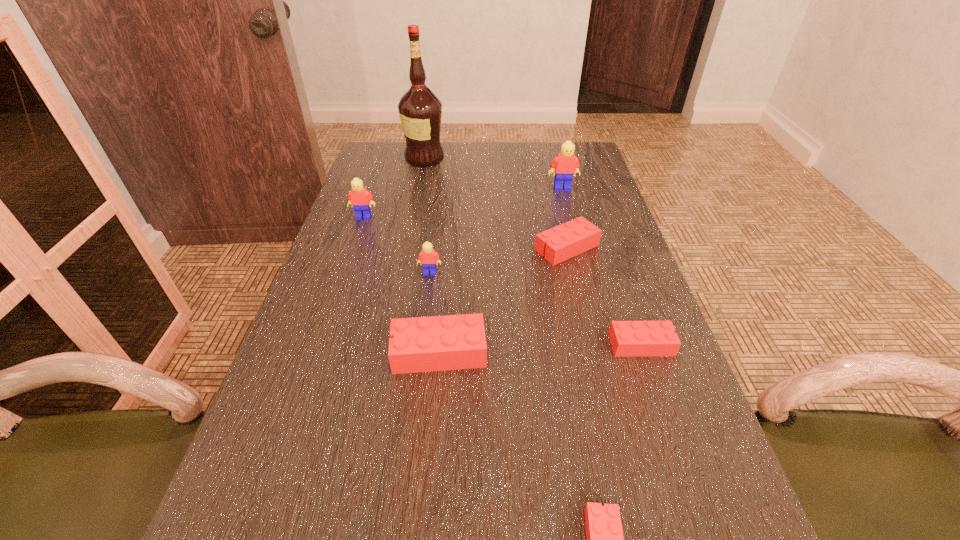
In order to click on yellow Lego that is the second closest to the nearest yellow Lego in this screenshot , I will do `click(565, 164)`.

Find the location of a particular element. The height and width of the screenshot is (540, 960). the third closest red Lego to the second yellow Lego from left to right is located at coordinates (628, 338).

Locate an element on the screen. The height and width of the screenshot is (540, 960). red Lego that stands as the closest to the nearest object is located at coordinates (437, 343).

Where is `free location that satisfies the following two spatial constraints: 1. on the front-facing side of the rightmost yellow Lego; 2. on the left side of the seventh tallest object`? free location that satisfies the following two spatial constraints: 1. on the front-facing side of the rightmost yellow Lego; 2. on the left side of the seventh tallest object is located at coordinates (604, 345).

Identify the location of blank space that satisfies the following two spatial constraints: 1. on the label of the alcohol; 2. on the right side of the seventh tallest object. (388, 345).

This screenshot has width=960, height=540. Identify the location of vacant space that satisfies the following two spatial constraints: 1. on the label of the brown alcohol; 2. on the back side of the leftmost red Lego. (387, 352).

What are the coordinates of `vacant space that satisfies the following two spatial constraints: 1. on the label of the farthest object; 2. on the front-facing side of the third tallest object` in the screenshot? It's located at (413, 217).

What are the coordinates of `free location that satisfies the following two spatial constraints: 1. on the front-facing side of the fourth shortest object; 2. on the right side of the fourth farthest Lego` in the screenshot? It's located at (420, 352).

In order to click on vacant space that satisfies the following two spatial constraints: 1. on the front-facing side of the leftmost yellow Lego; 2. on the right side of the third biggest red Lego in this screenshot , I will do `click(320, 345)`.